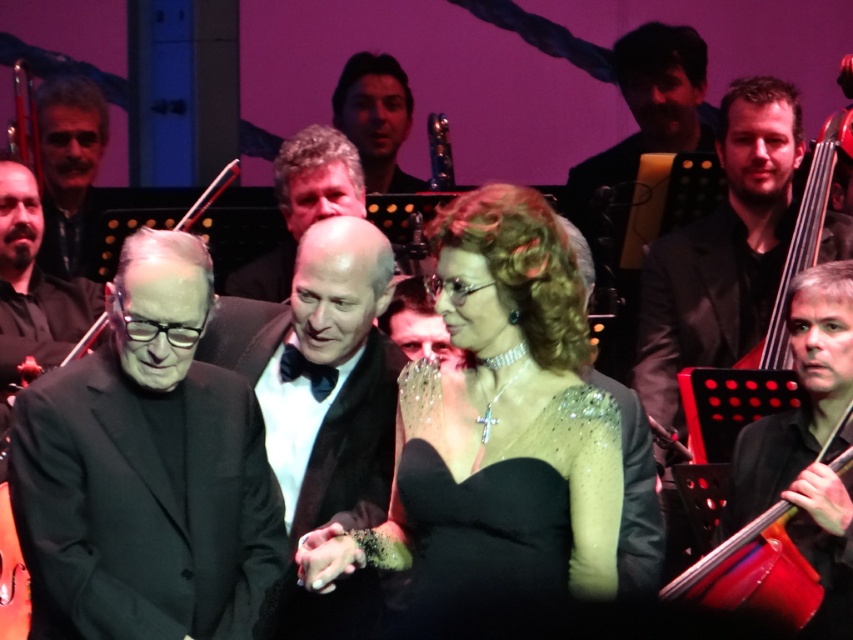
Is sparkling sequin dress at center to the left of black glossy suit at right from the viewer's perspective?

Indeed, sparkling sequin dress at center is positioned on the left side of black glossy suit at right.

Can you confirm if sparkling sequin dress at center is thinner than black glossy suit at right?

Indeed, sparkling sequin dress at center has a lesser width compared to black glossy suit at right.

Describe the element at coordinates (505, 515) in the screenshot. I see `sparkling sequin dress at center` at that location.

You are a GUI agent. You are given a task and a screenshot of the screen. Output one action in this format:
    pyautogui.click(x=<x>, y=<y>)
    Task: Click on the sparkling sequin dress at center
    
    Given the screenshot: What is the action you would take?
    pyautogui.click(x=505, y=515)

Is point (117, 353) more distant than point (408, 544)?

No, it is not.

From the picture: Is the position of black matte suit at center less distant than that of sparkling sequin dress at center?

No, black matte suit at center is behind sparkling sequin dress at center.

Is point (96, 460) farther from viewer compared to point (511, 445)?

No, it is not.

Identify the location of black matte suit at center. Image resolution: width=853 pixels, height=640 pixels. (146, 470).

Is black satin tuxedo at center above matte black suit at left?

No, black satin tuxedo at center is not above matte black suit at left.

Identify the location of black satin tuxedo at center. (321, 374).

Where is `black satin tuxedo at center`? This screenshot has width=853, height=640. black satin tuxedo at center is located at coordinates [x=321, y=374].